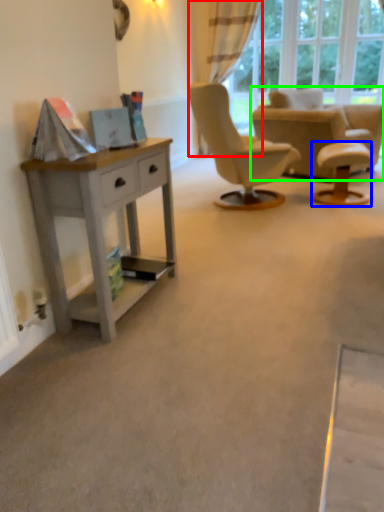
Question: Which is nearer to the curtain (highlighted by a red box)? stool (highlighted by a blue box) or chair (highlighted by a green box).

Choices:
 (A) stool
 (B) chair

Answer: (B)